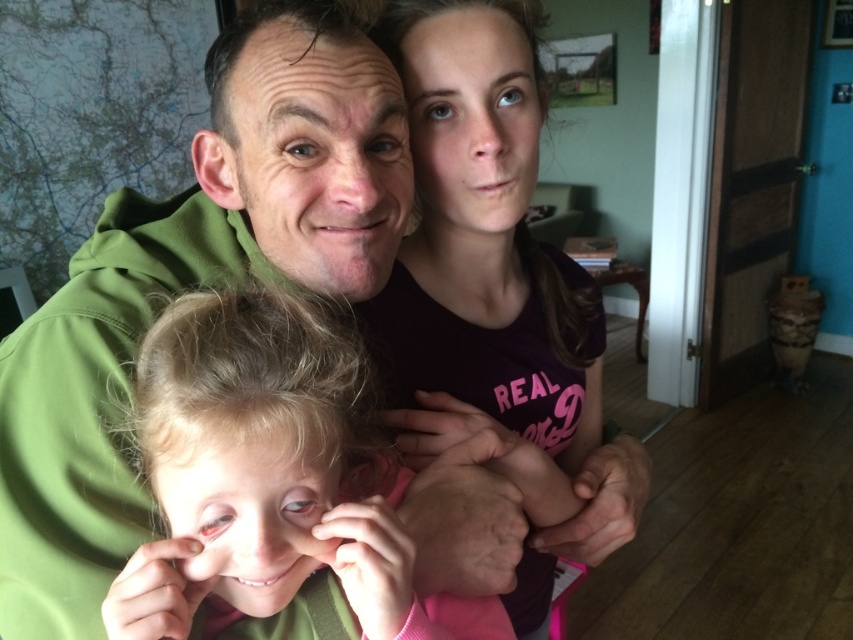
Question: Does matte purple shirt at upper center have a smaller size compared to blonde hair at center?

Choices:
 (A) yes
 (B) no

Answer: (B)

Question: Based on their relative distances, which object is farther from the blonde hair at center?

Choices:
 (A) green matte hoodie at center
 (B) matte purple shirt at upper center

Answer: (B)

Question: Which object appears closest to the camera in this image?

Choices:
 (A) green matte hoodie at center
 (B) blonde hair at center
 (C) matte purple shirt at upper center

Answer: (B)

Question: Is green matte hoodie at center bigger than matte purple shirt at upper center?

Choices:
 (A) yes
 (B) no

Answer: (B)

Question: Considering the relative positions of green matte hoodie at center and blonde hair at center in the image provided, where is green matte hoodie at center located with respect to blonde hair at center?

Choices:
 (A) right
 (B) left

Answer: (B)

Question: Which point appears farthest from the camera in this image?

Choices:
 (A) (355, 461)
 (B) (364, 54)

Answer: (B)